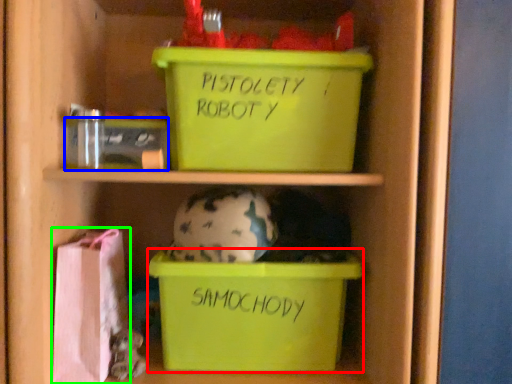
Question: Estimate the real-world distances between objects in this image. Which object is farther from storage box (highlighted by a red box), storage box (highlighted by a blue box) or material (highlighted by a green box)?

Choices:
 (A) storage box
 (B) material

Answer: (A)